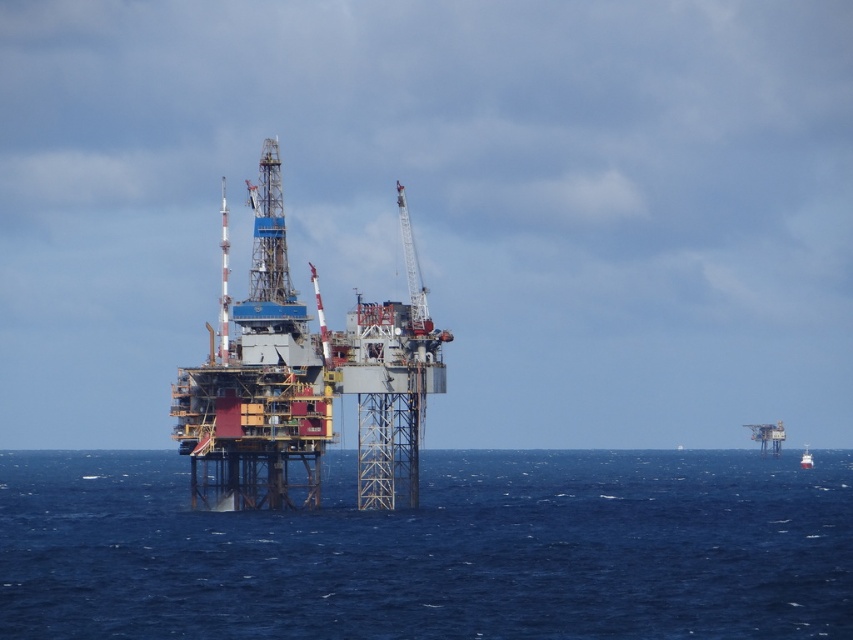
You are a marine biologist observing an offshore oil rig from a helicopter. You notice the blue water at center and the red glossy boat at far right. Which object in the scene is bigger in terms of area?

The blue water at center has a larger size compared to the red glossy boat at far right, so the blue water at center is bigger in terms of area.

You are a marine biologist observing the offshore oil rig. You need to collect water samples from the blue water at center. According to the coordinates provided, where exactly should you position your sampling device?

You should position your sampling device at the coordinates point (434, 548) where the blue water at center is located.

You are a marine biologist observing the offshore oil rig. You notice a point at coordinates (434, 548). What is located at this point?

The point at coordinates (434, 548) is occupied by blue water at center.